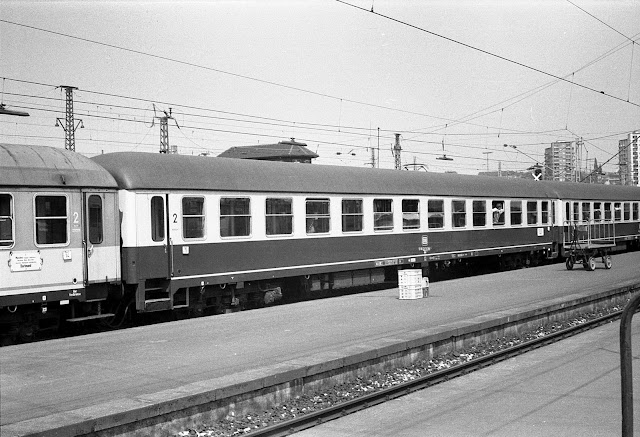
Where is `tall oval window`? Image resolution: width=640 pixels, height=437 pixels. tall oval window is located at coordinates (95, 221), (156, 220), (566, 210).